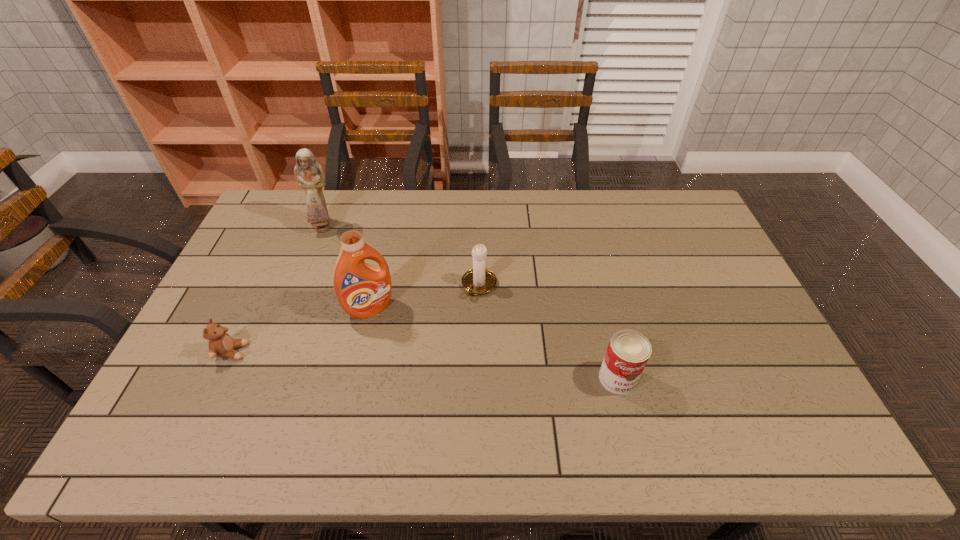
Find the location of a particular element. empty location between the teddy bear and the farthest object is located at coordinates (277, 289).

Locate an element on the screen. This screenshot has width=960, height=540. vacant area that lies between the shortest object and the rightmost object is located at coordinates (425, 365).

This screenshot has width=960, height=540. What are the coordinates of `free space between the second object from right to left and the detergent` in the screenshot? It's located at (424, 297).

Choose which object is the nearest neighbor to the shortest object. Please provide its 2D coordinates. Your answer should be formatted as a tuple, i.e. [(x, y)], where the tuple contains the x and y coordinates of a point satisfying the conditions above.

[(362, 290)]

At what (x,y) coordinates should I click in order to perform the action: click on object that is the nearest to the fourth object from left to right. Please return your answer as a coordinate pair (x, y). Image resolution: width=960 pixels, height=540 pixels. Looking at the image, I should click on (x=362, y=290).

This screenshot has width=960, height=540. Find the location of `blank space that satisfies the following two spatial constraints: 1. on the front side of the farthest object; 2. on the right side of the candle holder`. blank space that satisfies the following two spatial constraints: 1. on the front side of the farthest object; 2. on the right side of the candle holder is located at coordinates (300, 286).

The image size is (960, 540). Find the location of `free region that satisfies the following two spatial constraints: 1. on the front side of the third object from right to left; 2. on the right side of the fourth object from right to left`. free region that satisfies the following two spatial constraints: 1. on the front side of the third object from right to left; 2. on the right side of the fourth object from right to left is located at coordinates (292, 308).